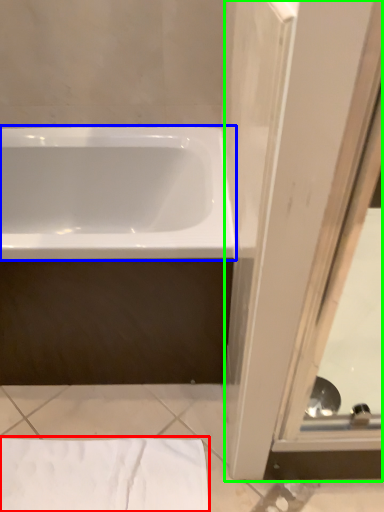
Question: Based on their relative distances, which object is nearer to sheet (highlighted by a red box)? Choose from bathtub (highlighted by a blue box) and screen door (highlighted by a green box).

Choices:
 (A) bathtub
 (B) screen door

Answer: (B)